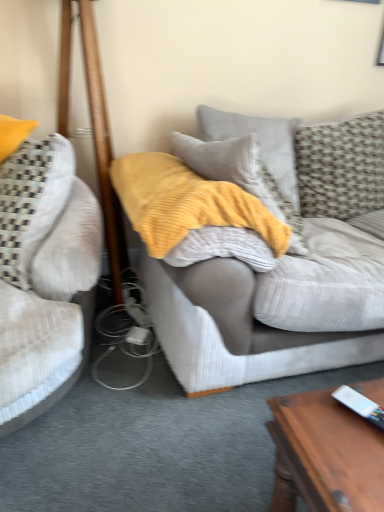
Question: Based on their positions, is velvet beige couch at left, which is the 2th studio couch from right to left, located to the left or right of wooden pole at left?

Choices:
 (A) left
 (B) right

Answer: (A)

Question: In terms of size, does velvet beige couch at left, which is the 2th studio couch from right to left, appear bigger or smaller than wooden pole at left?

Choices:
 (A) small
 (B) big

Answer: (A)

Question: Which of these objects is positioned closest to the wooden pole at left?

Choices:
 (A) textured beige pillow at upper right, the first pillow when ordered from right to left
 (B) textured gray pillow at upper right, placed as the second pillow when sorted from right to left
 (C) white plastic remote control at lower right
 (D) textured gray couch at center, which is the 2th studio couch in left-to-right order
 (E) velvet beige couch at left, which is the 2th studio couch from right to left

Answer: (E)

Question: Which object is positioned farthest from the white plastic remote control at lower right?

Choices:
 (A) textured gray pillow at upper right, placed as the second pillow when sorted from right to left
 (B) textured gray couch at center, the first studio couch when ordered from right to left
 (C) velvet beige couch at left, the 1th studio couch when ordered from left to right
 (D) yellow textured blanket at center
 (E) wooden pole at left

Answer: (E)